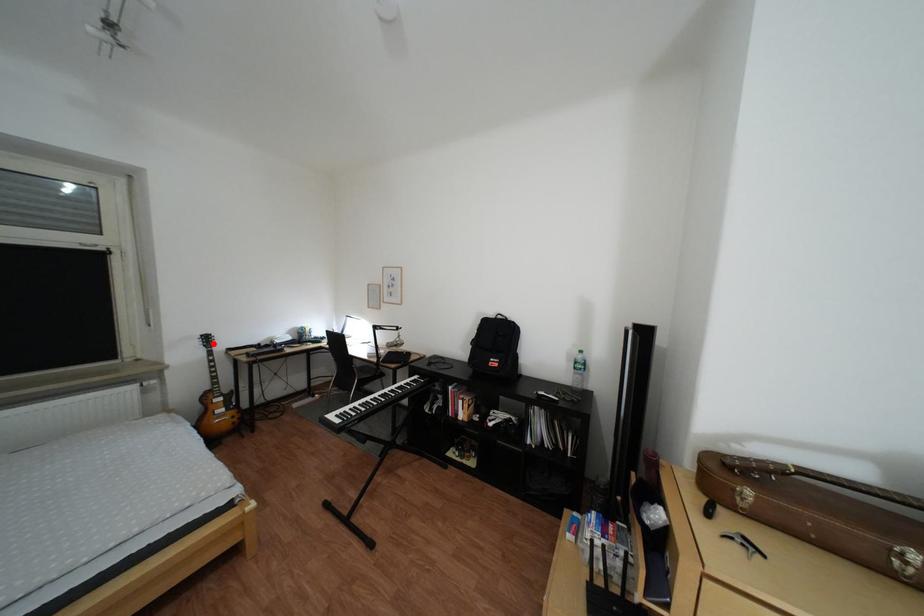
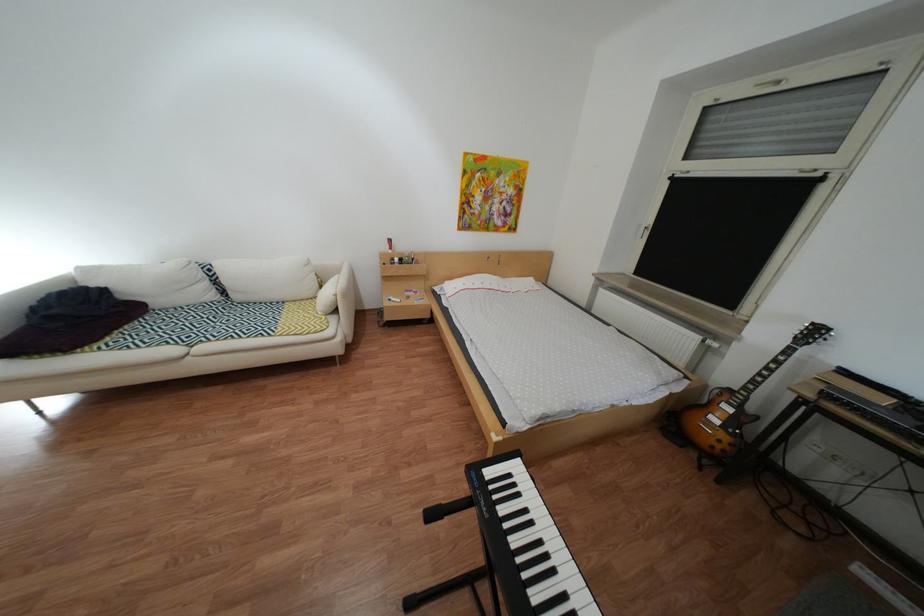
Find the pixel in the second image that matches the highlighted location in the first image.

(810, 330)